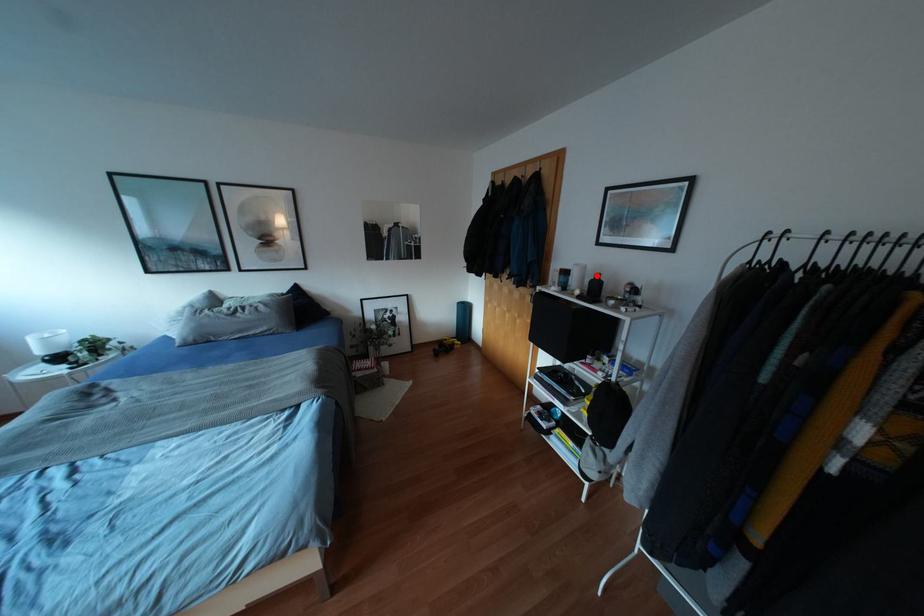
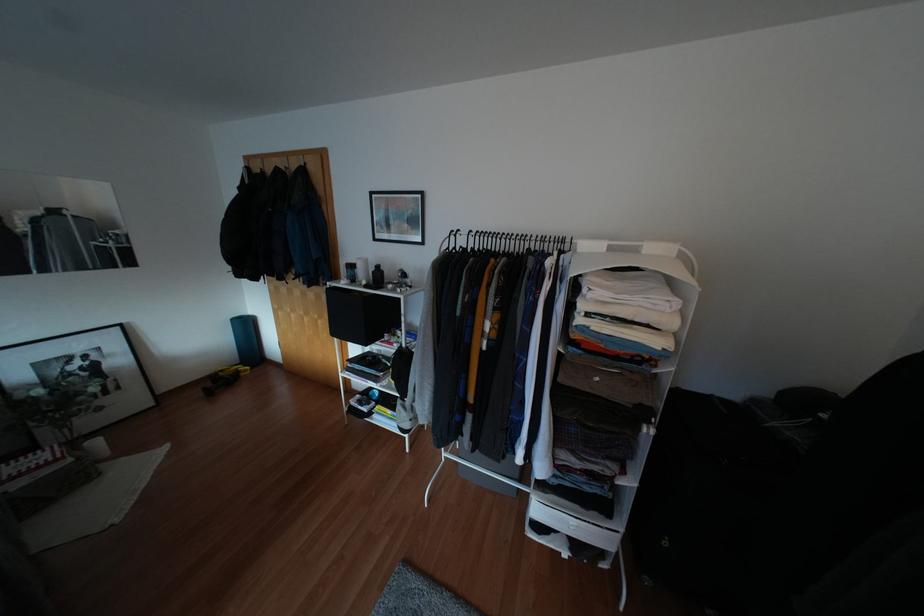
In the second image, find the point that corresponds to the highlighted location in the first image.

(377, 265)